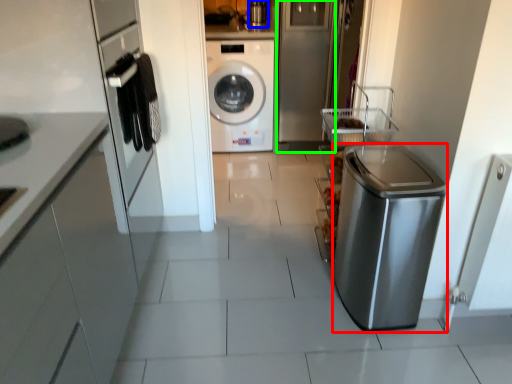
Question: Which object is positioned farthest from dish washer (highlighted by a red box)? Select from appliance (highlighted by a blue box) and glass door (highlighted by a green box).

Choices:
 (A) appliance
 (B) glass door

Answer: (A)